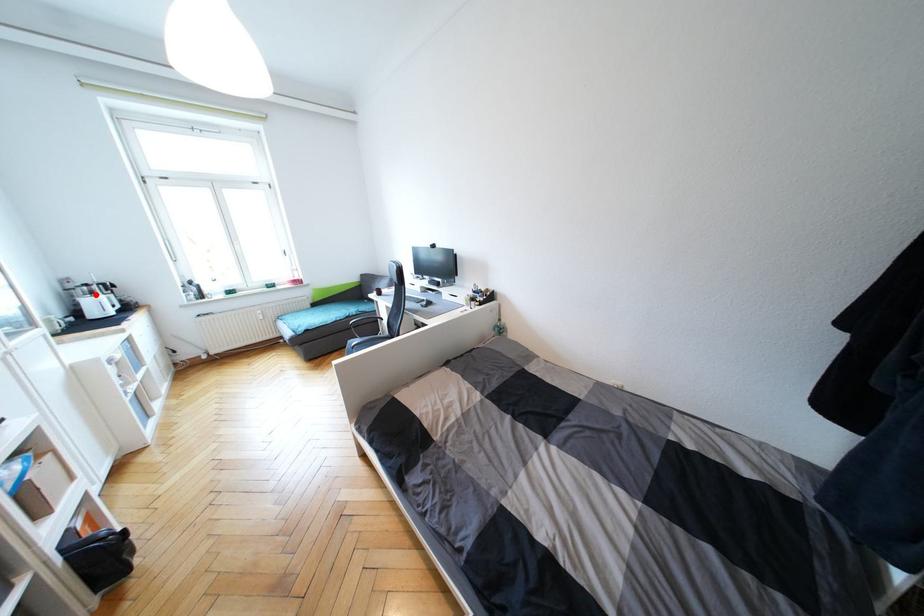
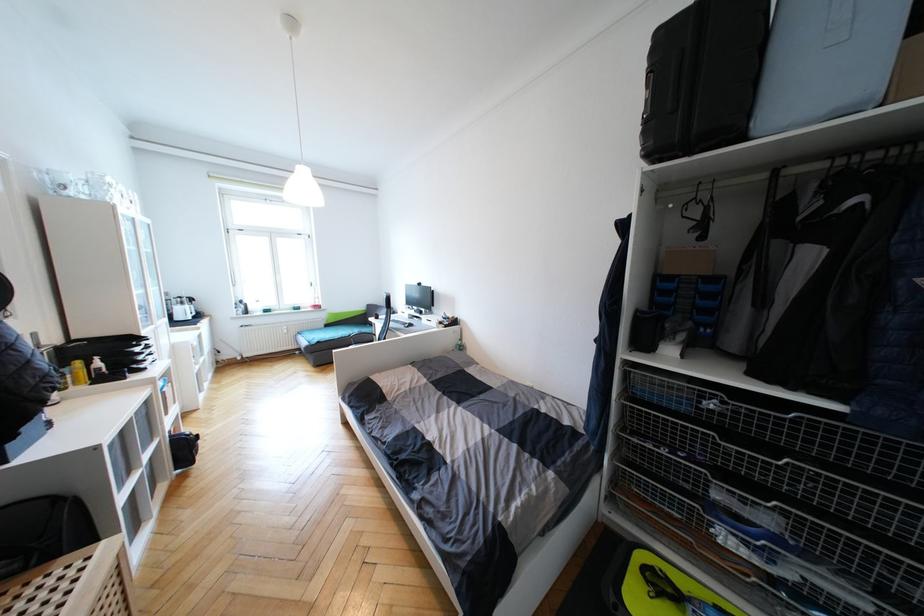
Question: I am providing you with two images of the same scene from different viewpoints. A red point is marked on the first image. At the location where the point appears in image 1, is it still visible in image 2?

Choices:
 (A) Yes
 (B) No

Answer: (A)